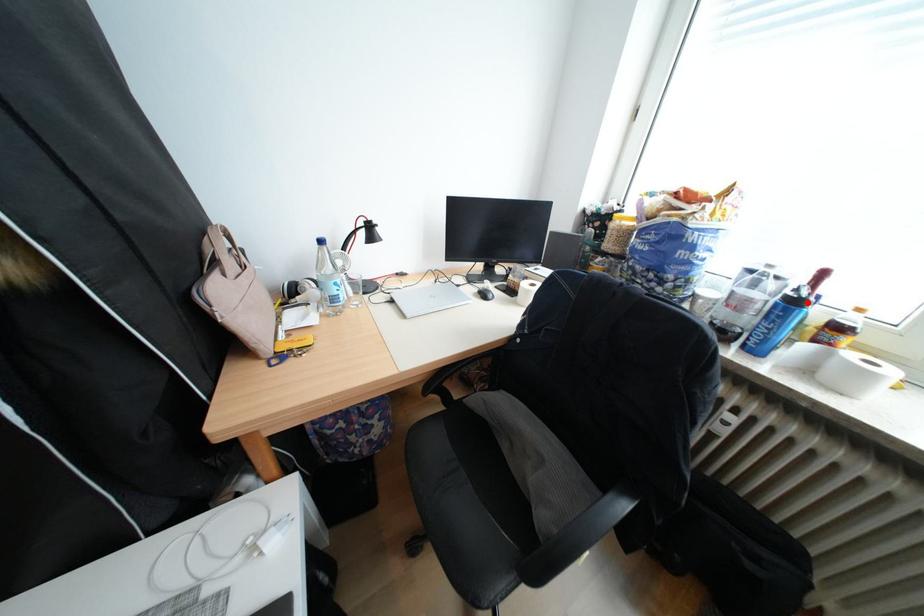
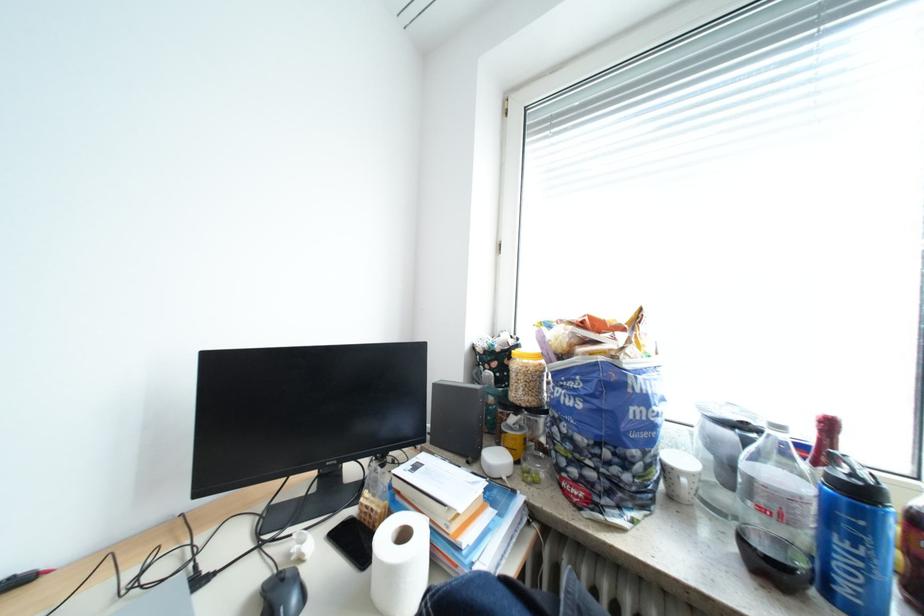
The point at the highlighted location is marked in the first image. Where is the corresponding point in the second image?

(873, 493)